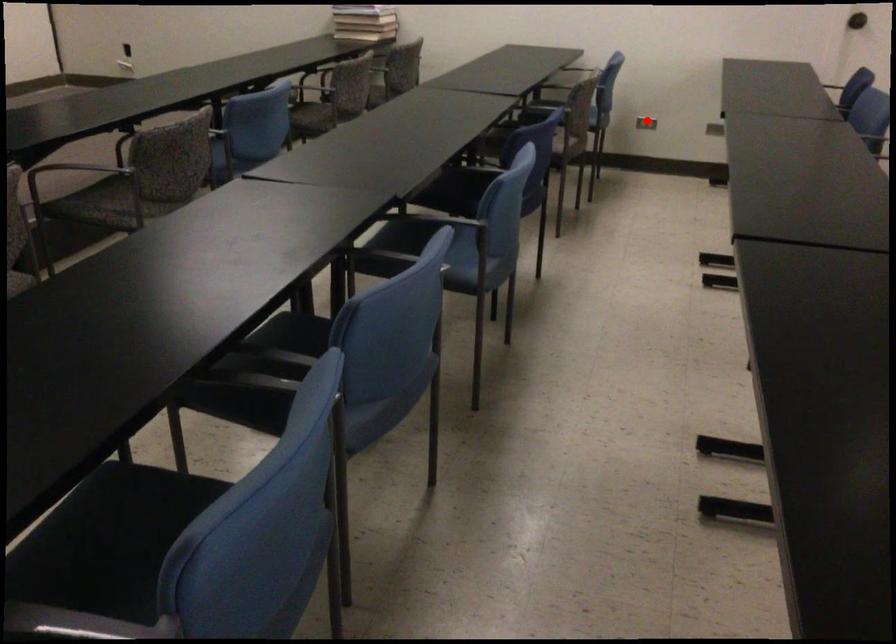
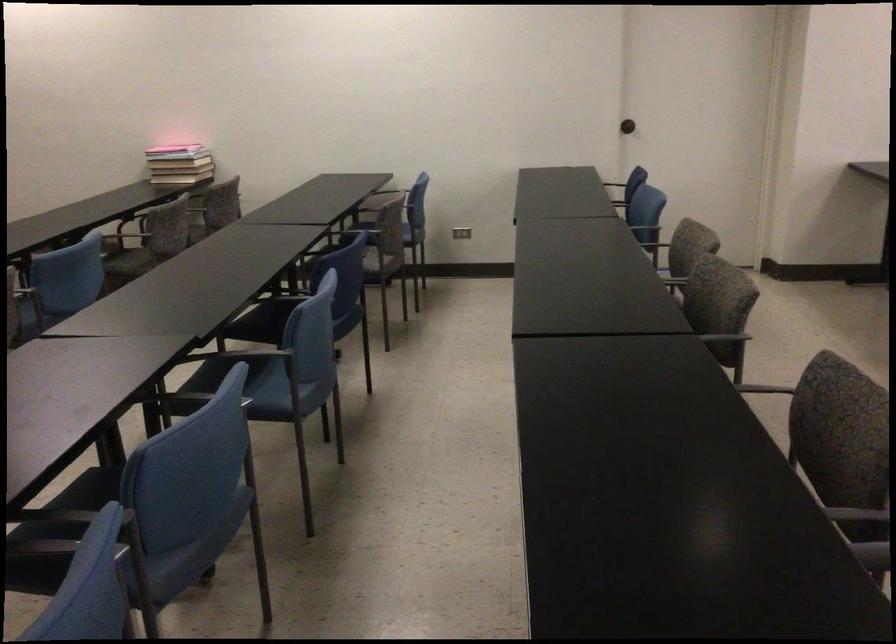
In the second image, find the point that corresponds to the highlighted location in the first image.

(461, 232)